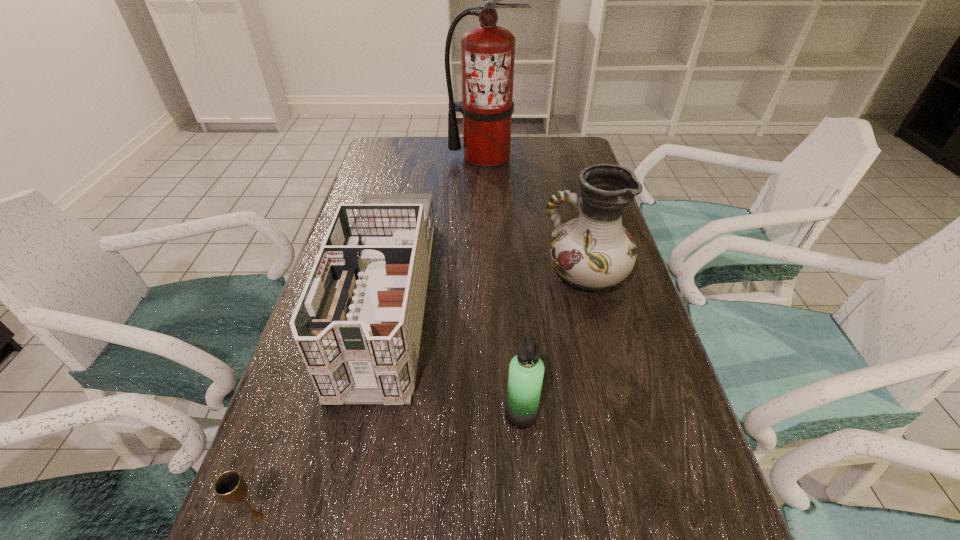
This screenshot has width=960, height=540. Find the location of `vacant space located 0.320m on the back of the thermos bottle`. vacant space located 0.320m on the back of the thermos bottle is located at coordinates (512, 285).

You are a GUI agent. You are given a task and a screenshot of the screen. Output one action in this format:
    pyautogui.click(x=<x>, y=<y>)
    Task: Click on the vacant position located 0.120m at the entrance of the fourth object from right to left
    Image resolution: width=960 pixels, height=540 pixels.
    Given the screenshot: What is the action you would take?
    pyautogui.click(x=348, y=475)

You are a GUI agent. You are given a task and a screenshot of the screen. Output one action in this format:
    pyautogui.click(x=<x>, y=<y>)
    Task: Click on the vacant area situated on the back of the nearest object
    Image resolution: width=960 pixels, height=540 pixels.
    Given the screenshot: What is the action you would take?
    pyautogui.click(x=276, y=462)

Where is `object at the far edge`? The image size is (960, 540). object at the far edge is located at coordinates (487, 51).

The height and width of the screenshot is (540, 960). In order to click on dollhouse that is positioned at the left edge in this screenshot , I will do `click(358, 322)`.

Locate an element on the screen. chalice at the left edge is located at coordinates (231, 487).

Where is `object that is at the right edge`? The image size is (960, 540). object that is at the right edge is located at coordinates (592, 253).

The height and width of the screenshot is (540, 960). What are the coordinates of `vacant space at the far edge` in the screenshot? It's located at (516, 157).

In the image, there is a desktop. What are the coordinates of `free region at the left edge` in the screenshot? It's located at (281, 511).

In the image, there is a desktop. Identify the location of vacant area at the right edge. (668, 434).